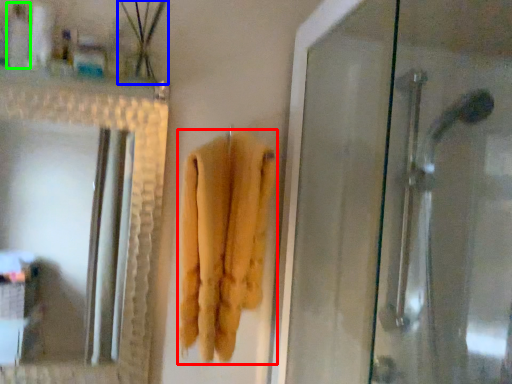
Question: Based on their relative distances, which object is farther from towel (highlighted by a red box)? Choose from plant (highlighted by a blue box) and toiletry (highlighted by a green box).

Choices:
 (A) plant
 (B) toiletry

Answer: (B)